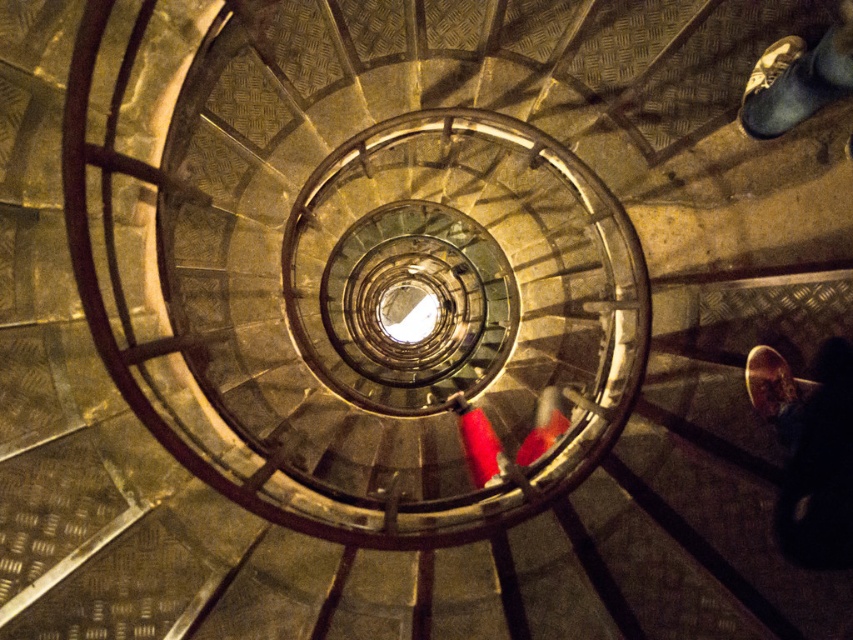
You are standing at the top of the spiral staircase and want to reach the bottom. You notice two points marked on the railing at coordinates point (840, 385) and point (840, 96). Which point should you move towards to descend the staircase?

You should move towards point (840, 96) because point (840, 385) is behind it, meaning point (840, 96) is closer to the bottom of the staircase.

You are standing at the top of the spiral staircase and want to take a photo of two points on the steps. The first point is at coordinates point [790,120] and the second is at point [525,451]. Which point will appear larger in your photo?

Point [790,120] will appear larger in the photo because it is closer to the camera than point [525,451].